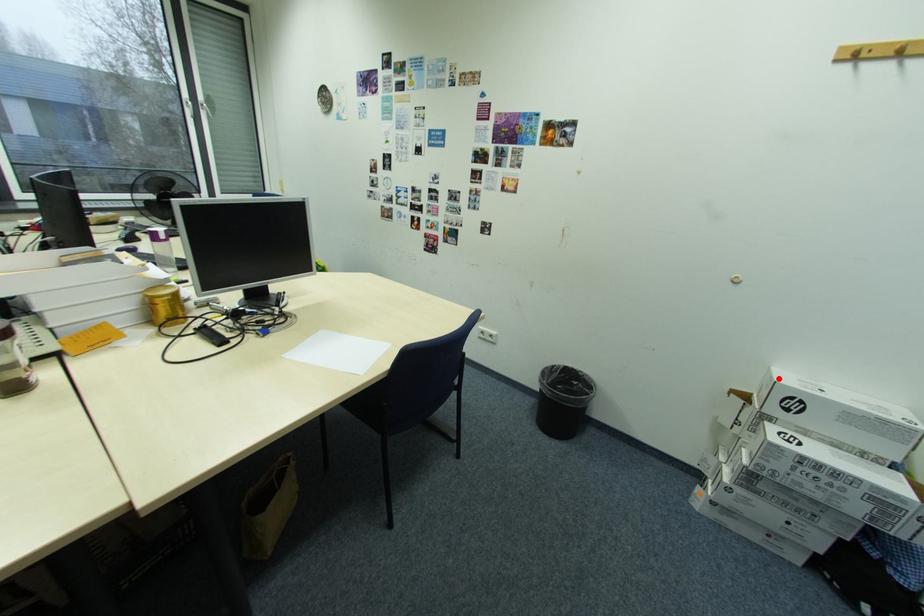
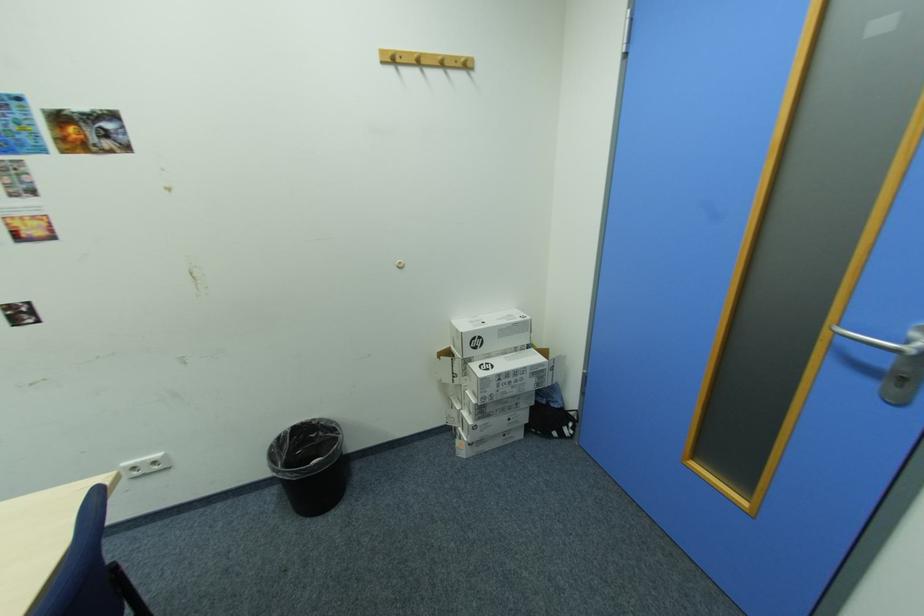
Question: I am providing you with two images of the same scene from different viewpoints. A red point is marked on the first image. At the location where the point appears in image 1, is it still visible in image 2?

Choices:
 (A) Yes
 (B) No

Answer: (A)